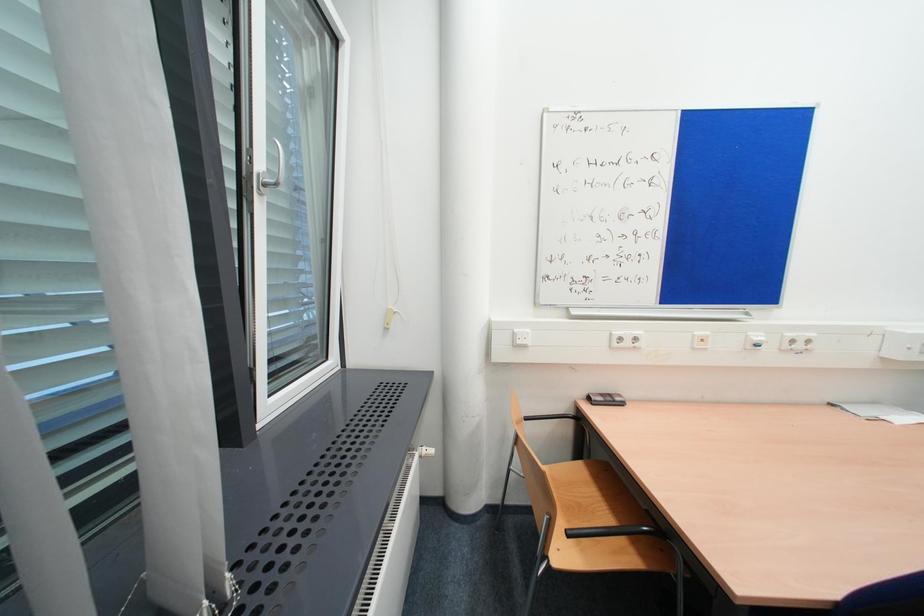
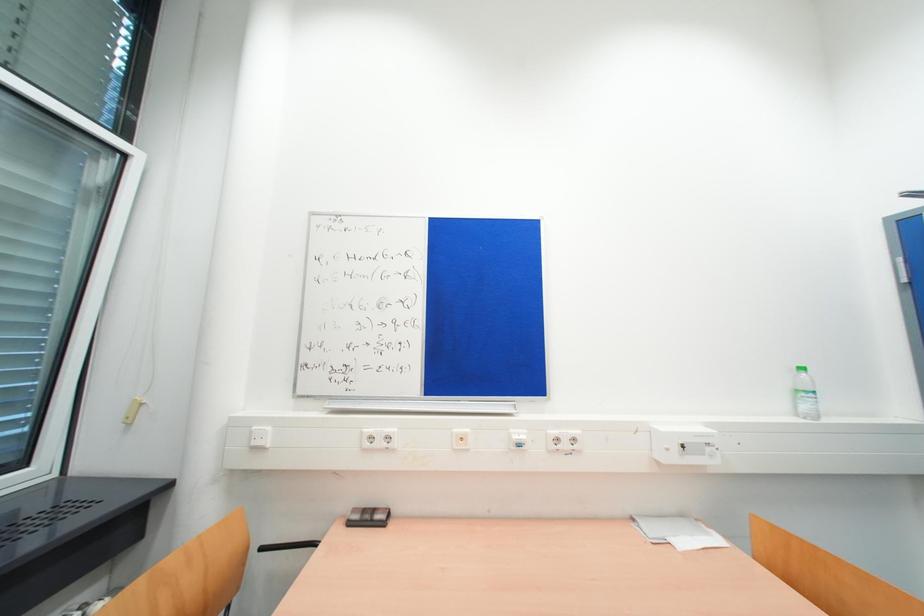
Question: What movement of the cameraman would produce the second image?

Choices:
 (A) Left
 (B) Right
 (C) Forward
 (D) Backward

Answer: (B)